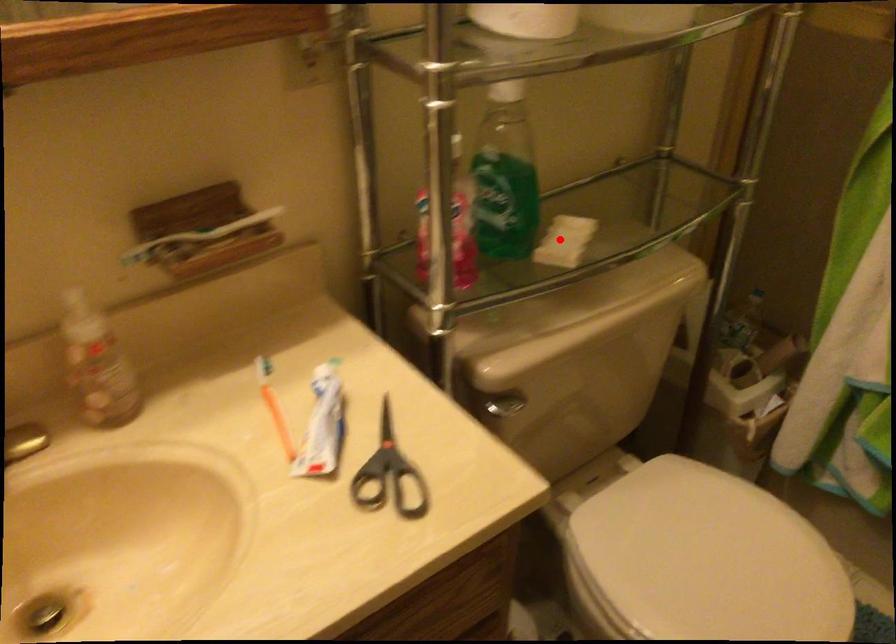
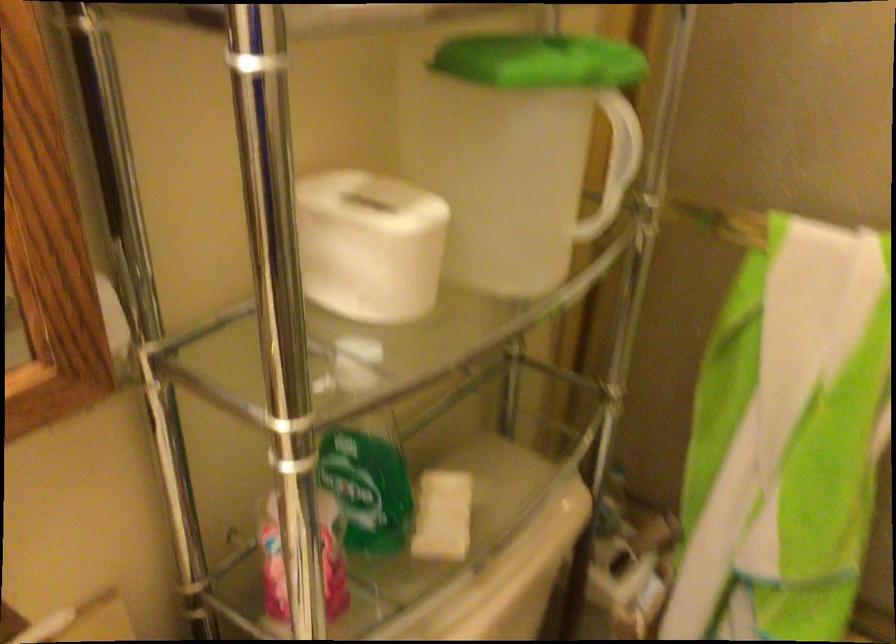
Question: A red point is marked in image1. In image2, is the corresponding 3D point closer to the camera or farther? Reply with the corresponding letter.

Choices:
 (A) The corresponding 3D point is closer.
 (B) The corresponding 3D point is farther.

Answer: (A)